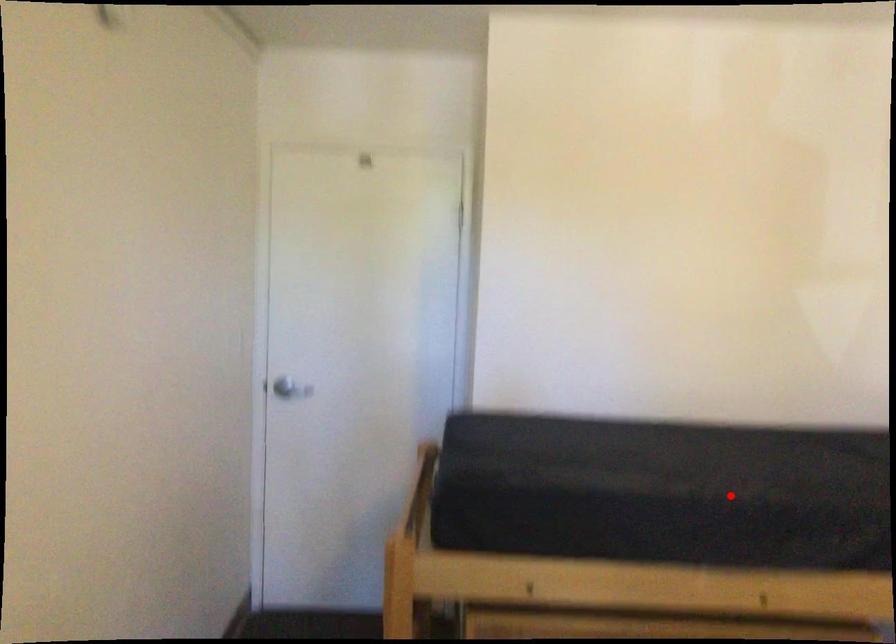
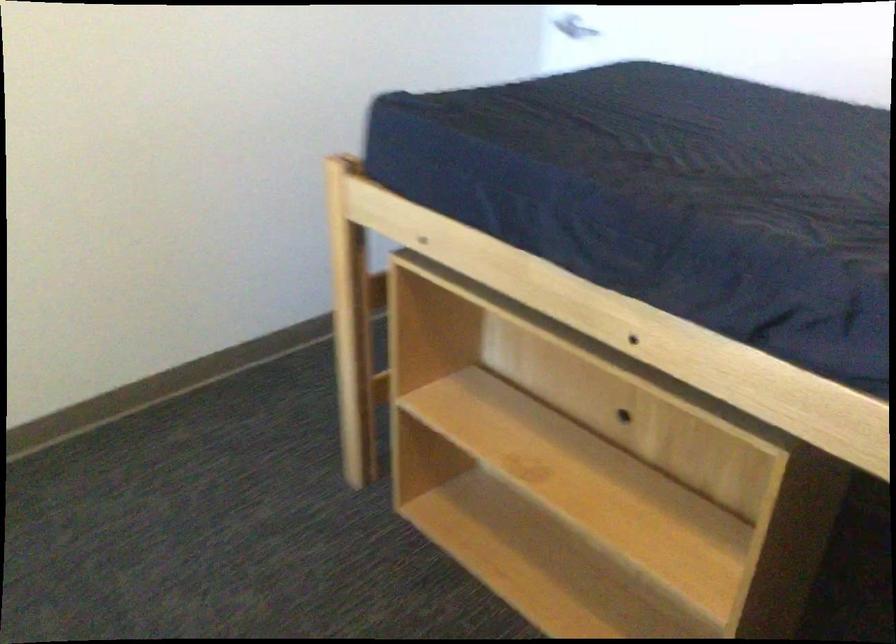
Where in the second image is the point corresponding to the highlighted location from the first image?

(651, 193)